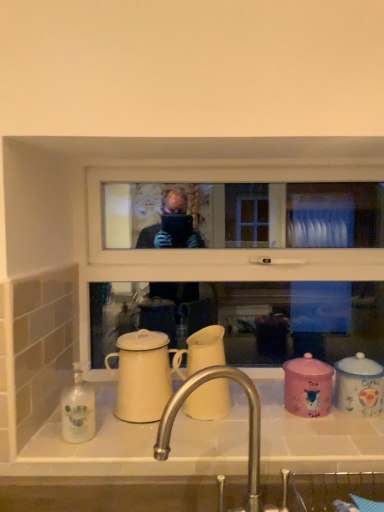
Question: Would you say white glossy sink at lower center is outside matte white mug at center, the 1th coffee cup in the left-to-right sequence?

Choices:
 (A) yes
 (B) no

Answer: (A)

Question: From a real-world perspective, is white glossy sink at lower center over matte white mug at center, the 1th coffee cup in the left-to-right sequence?

Choices:
 (A) no
 (B) yes

Answer: (A)

Question: Can you confirm if white glossy sink at lower center is wider than matte white mug at center, which ranks as the fourth coffee cup in right-to-left order?

Choices:
 (A) yes
 (B) no

Answer: (A)

Question: Considering the relative sizes of white glossy sink at lower center and matte white mug at center, which ranks as the fourth coffee cup in right-to-left order, in the image provided, is white glossy sink at lower center smaller than matte white mug at center, which ranks as the fourth coffee cup in right-to-left order,?

Choices:
 (A) no
 (B) yes

Answer: (A)

Question: Considering the relative sizes of white glossy sink at lower center and matte white mug at center, the 1th coffee cup in the left-to-right sequence, in the image provided, is white glossy sink at lower center taller than matte white mug at center, the 1th coffee cup in the left-to-right sequence,?

Choices:
 (A) yes
 (B) no

Answer: (B)

Question: Does white glossy sink at lower center have a larger size compared to matte white mug at center, the 1th coffee cup in the left-to-right sequence?

Choices:
 (A) no
 (B) yes

Answer: (B)

Question: Does white matte coffee cup at center, the third coffee cup when ordered from right to left, contain matte white mug at center, the 1th coffee cup in the left-to-right sequence?

Choices:
 (A) yes
 (B) no

Answer: (B)

Question: From a real-world perspective, is white matte coffee cup at center, the third coffee cup when ordered from right to left, under matte white mug at center, which ranks as the fourth coffee cup in right-to-left order?

Choices:
 (A) yes
 (B) no

Answer: (B)

Question: Is white matte coffee cup at center, the second coffee cup in the left-to-right sequence, not within matte white mug at center, the 1th coffee cup in the left-to-right sequence?

Choices:
 (A) no
 (B) yes

Answer: (B)

Question: Is white matte coffee cup at center, the third coffee cup when ordered from right to left, oriented away from matte white mug at center, the 1th coffee cup in the left-to-right sequence?

Choices:
 (A) yes
 (B) no

Answer: (B)

Question: Can you confirm if white matte coffee cup at center, the third coffee cup when ordered from right to left, is thinner than matte white mug at center, the 1th coffee cup in the left-to-right sequence?

Choices:
 (A) yes
 (B) no

Answer: (A)

Question: Can you confirm if white matte coffee cup at center, the second coffee cup in the left-to-right sequence, is taller than matte white mug at center, which ranks as the fourth coffee cup in right-to-left order?

Choices:
 (A) no
 (B) yes

Answer: (A)

Question: Does blue glossy coffee cup at right, positioned as the 4th coffee cup in left-to-right order, have a larger size compared to white glossy sink at lower center?

Choices:
 (A) yes
 (B) no

Answer: (B)